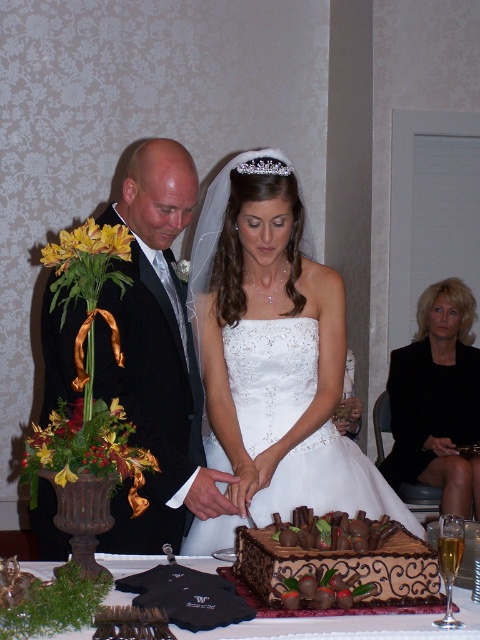
Question: Is white satin dress at center to the left of black fabric dress at lower right from the viewer's perspective?

Choices:
 (A) yes
 (B) no

Answer: (A)

Question: Which object appears farthest from the camera in this image?

Choices:
 (A) white satin dress at center
 (B) clear crystal tiara at upper center

Answer: (B)

Question: Can you confirm if black fabric dress at lower right is positioned to the right of dark brown wood cake at center?

Choices:
 (A) yes
 (B) no

Answer: (A)

Question: Where is white satin dress at center located in relation to clear crystal tiara at upper center in the image?

Choices:
 (A) left
 (B) right

Answer: (B)

Question: Among these points, which one is nearest to the camera?

Choices:
 (A) (251, 164)
 (B) (180, 531)
 (C) (290, 451)
 (D) (156, 561)

Answer: (D)

Question: Estimate the real-world distances between objects in this image. Which object is farther from the white satin dress at center?

Choices:
 (A) clear crystal tiara at upper center
 (B) black fabric dress at lower right

Answer: (B)